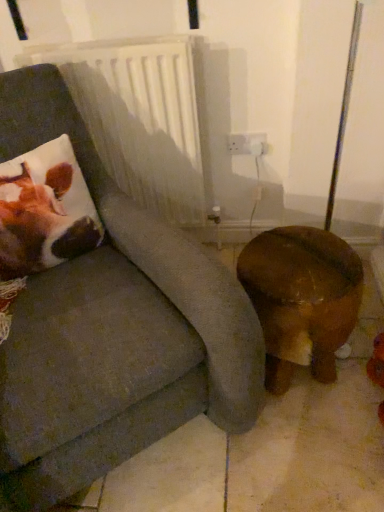
Question: Should I look upward or downward to see brown plush cushion at left?

Choices:
 (A) down
 (B) up

Answer: (B)

Question: Would you say brown wooden stool at lower right is outside white plastic radiator at upper center?

Choices:
 (A) no
 (B) yes

Answer: (B)

Question: From a real-world perspective, is brown wooden stool at lower right physically above white plastic radiator at upper center?

Choices:
 (A) yes
 (B) no

Answer: (B)

Question: Is brown wooden stool at lower right smaller than white plastic radiator at upper center?

Choices:
 (A) yes
 (B) no

Answer: (A)

Question: Does brown wooden stool at lower right come behind white plastic radiator at upper center?

Choices:
 (A) yes
 (B) no

Answer: (B)

Question: Does brown wooden stool at lower right have a larger size compared to white plastic radiator at upper center?

Choices:
 (A) yes
 (B) no

Answer: (B)

Question: Considering the relative positions of brown wooden stool at lower right and white plastic radiator at upper center in the image provided, is brown wooden stool at lower right to the left of white plastic radiator at upper center from the viewer's perspective?

Choices:
 (A) no
 (B) yes

Answer: (A)

Question: Is brown wooden stool at lower right with brown plush cushion at left?

Choices:
 (A) yes
 (B) no

Answer: (B)

Question: Can you confirm if brown wooden stool at lower right is bigger than brown plush cushion at left?

Choices:
 (A) no
 (B) yes

Answer: (B)

Question: Would you say brown wooden stool at lower right contains brown plush cushion at left?

Choices:
 (A) no
 (B) yes

Answer: (A)

Question: Can you confirm if brown wooden stool at lower right is smaller than brown plush cushion at left?

Choices:
 (A) no
 (B) yes

Answer: (A)

Question: From a real-world perspective, is brown wooden stool at lower right positioned under brown plush cushion at left based on gravity?

Choices:
 (A) yes
 (B) no

Answer: (A)

Question: Would you consider brown wooden stool at lower right to be distant from brown plush cushion at left?

Choices:
 (A) no
 (B) yes

Answer: (A)

Question: Is brown plush cushion at left oriented towards white plastic radiator at upper center?

Choices:
 (A) yes
 (B) no

Answer: (B)